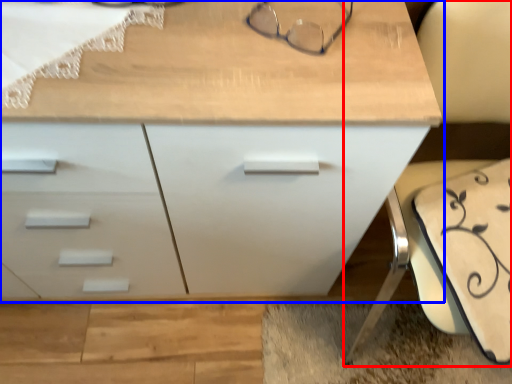
Question: Which object is closer to the camera taking this photo, swivel chair (highlighted by a red box) or chest of drawers (highlighted by a blue box)?

Choices:
 (A) swivel chair
 (B) chest of drawers

Answer: (A)